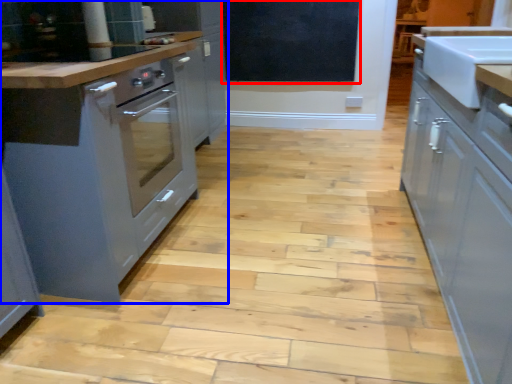
Question: Which object is further to the camera taking this photo, bulletin board (highlighted by a red box) or cabinetry (highlighted by a blue box)?

Choices:
 (A) bulletin board
 (B) cabinetry

Answer: (A)